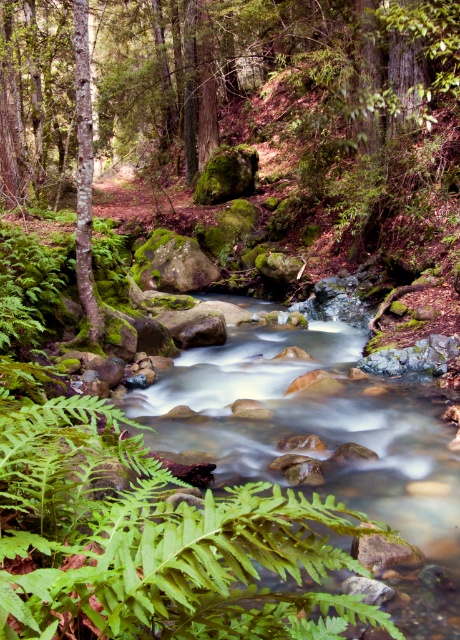
Question: Among these points, which one is nearest to the camera?

Choices:
 (A) (281, 237)
 (B) (82, 180)
 (C) (115, 448)

Answer: (C)

Question: Where is green mossy tree at center located in relation to green mossy tree at left in the image?

Choices:
 (A) right
 (B) left

Answer: (A)

Question: Which of the following is the farthest from the observer?

Choices:
 (A) (40, 134)
 (B) (91, 161)

Answer: (A)

Question: From the image, what is the correct spatial relationship of green mossy tree at center in relation to green mossy tree at left?

Choices:
 (A) above
 (B) below

Answer: (A)

Question: Does green mossy tree at center appear over green mossy tree at left?

Choices:
 (A) yes
 (B) no

Answer: (A)

Question: Among these objects, which one is farthest from the camera?

Choices:
 (A) green mossy tree at left
 (B) green leafy fern at lower left
 (C) green mossy tree at center

Answer: (A)